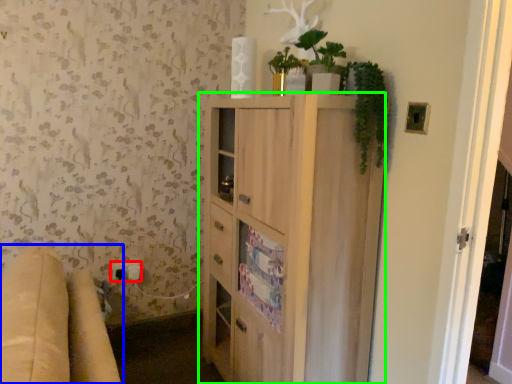
Question: Estimate the real-world distances between objects in this image. Which object is farther from electric outlet (highlighted by a red box), studio couch (highlighted by a blue box) or cabinetry (highlighted by a green box)?

Choices:
 (A) studio couch
 (B) cabinetry

Answer: (A)